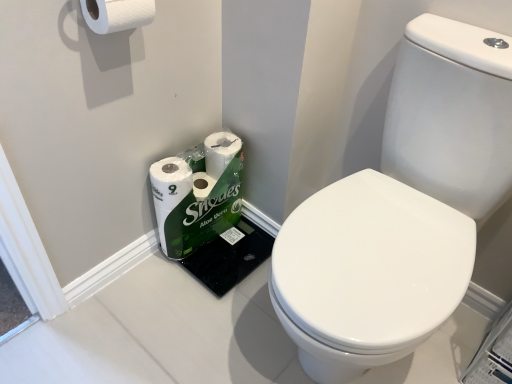
Question: Considering the relative sizes of white glossy toilet paper at lower left, the first toilet paper from the back, and white glossy toilet at center in the image provided, is white glossy toilet paper at lower left, the first toilet paper from the back, smaller than white glossy toilet at center?

Choices:
 (A) no
 (B) yes

Answer: (B)

Question: Are white glossy toilet paper at lower left, the second toilet paper in the front-to-back sequence, and white glossy toilet at center making contact?

Choices:
 (A) no
 (B) yes

Answer: (A)

Question: Is white glossy toilet paper at lower left, the first toilet paper from the back, aimed at white glossy toilet at center?

Choices:
 (A) yes
 (B) no

Answer: (A)

Question: Can you confirm if white glossy toilet paper at lower left, the first toilet paper from the back, is taller than white glossy toilet at center?

Choices:
 (A) yes
 (B) no

Answer: (B)

Question: Can you confirm if white glossy toilet paper at lower left, marked as the 2th toilet paper in a top-to-bottom arrangement, is thinner than white glossy toilet at center?

Choices:
 (A) yes
 (B) no

Answer: (A)

Question: Would you say white glossy toilet paper at lower left, the first toilet paper from the back, contains white glossy toilet at center?

Choices:
 (A) no
 (B) yes

Answer: (A)

Question: Does white glossy toilet at center turn towards white glossy toilet paper at lower left, the first toilet paper from the back?

Choices:
 (A) no
 (B) yes

Answer: (A)

Question: Is the position of white glossy toilet at center more distant than that of white glossy toilet paper at lower left, marked as the 2th toilet paper in a top-to-bottom arrangement?

Choices:
 (A) no
 (B) yes

Answer: (A)

Question: Can you confirm if white glossy toilet at center is positioned to the right of white glossy toilet paper at lower left, acting as the first toilet paper starting from the bottom?

Choices:
 (A) yes
 (B) no

Answer: (A)

Question: From the image's perspective, is white glossy toilet at center located above white glossy toilet paper at lower left, the first toilet paper from the back?

Choices:
 (A) no
 (B) yes

Answer: (A)

Question: Considering the relative sizes of white glossy toilet at center and white glossy toilet paper at lower left, the first toilet paper from the back, in the image provided, is white glossy toilet at center smaller than white glossy toilet paper at lower left, the first toilet paper from the back,?

Choices:
 (A) no
 (B) yes

Answer: (A)

Question: Can you confirm if white glossy toilet at center is thinner than white glossy toilet paper at lower left, acting as the first toilet paper starting from the bottom?

Choices:
 (A) yes
 (B) no

Answer: (B)

Question: From a real-world perspective, is white matte toilet paper at upper left, the first toilet paper viewed from the top, positioned under white glossy toilet at center based on gravity?

Choices:
 (A) no
 (B) yes

Answer: (A)